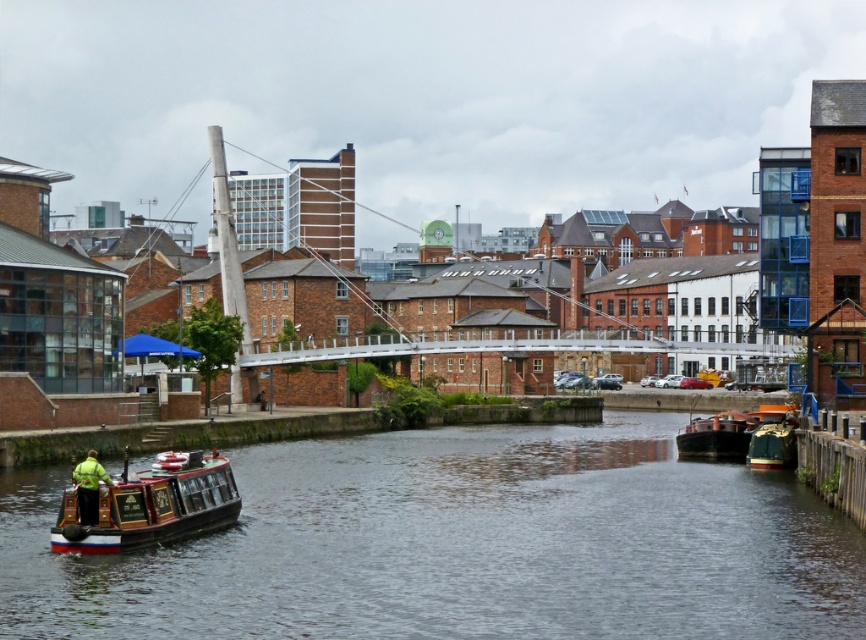
Question: Is smooth dark water at center wider than wooden polished boat at lower left?

Choices:
 (A) yes
 (B) no

Answer: (A)

Question: Which object is positioned closest to the wooden polished boat at lower left?

Choices:
 (A) wooden polished barge at lower right
 (B) smooth dark water at center

Answer: (B)

Question: Can you confirm if smooth dark water at center is wider than wooden polished barge at lower right?

Choices:
 (A) no
 (B) yes

Answer: (B)

Question: Which of the following is the closest to the observer?

Choices:
 (A) wooden polished boat at lower left
 (B) green fabric boat at lower right
 (C) smooth dark water at center
 (D) wooden polished barge at lower right

Answer: (C)

Question: Based on their relative distances, which object is nearer to the smooth dark water at center?

Choices:
 (A) wooden polished barge at lower right
 (B) wooden polished boat at lower left
 (C) green fabric jacket at lower left
 (D) green fabric boat at lower right

Answer: (B)

Question: From the image, what is the correct spatial relationship of smooth dark water at center in relation to wooden polished barge at lower right?

Choices:
 (A) below
 (B) above

Answer: (A)